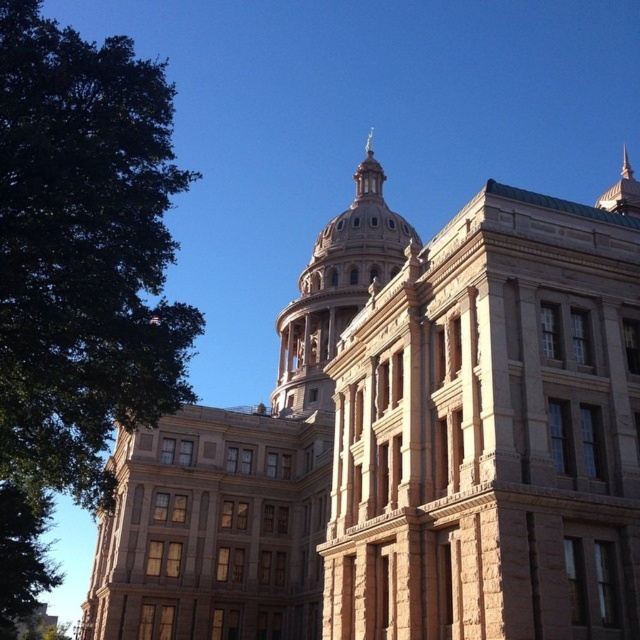
Which is behind, point (154, 353) or point (33, 509)?

Positioned behind is point (33, 509).

In order to click on green leafy tree at left in this screenshot , I will do `click(77, 275)`.

Consider the image. Who is positioned more to the right, green leafy tree at left or golden stone dome at center?

From the viewer's perspective, golden stone dome at center appears more on the right side.

Which is below, green leafy tree at left or golden stone dome at center?

Positioned lower is green leafy tree at left.

Who is more distant from viewer, (x=49, y=461) or (x=376, y=195)?

Positioned behind is point (x=376, y=195).

The height and width of the screenshot is (640, 640). I want to click on green leafy tree at left, so (77, 275).

Who is more forward, (342, 236) or (17, 497)?

Point (17, 497)

Which of these two, golden stone dome at center or green leafy tree at lower left, stands shorter?

green leafy tree at lower left

This screenshot has height=640, width=640. I want to click on golden stone dome at center, so click(337, 289).